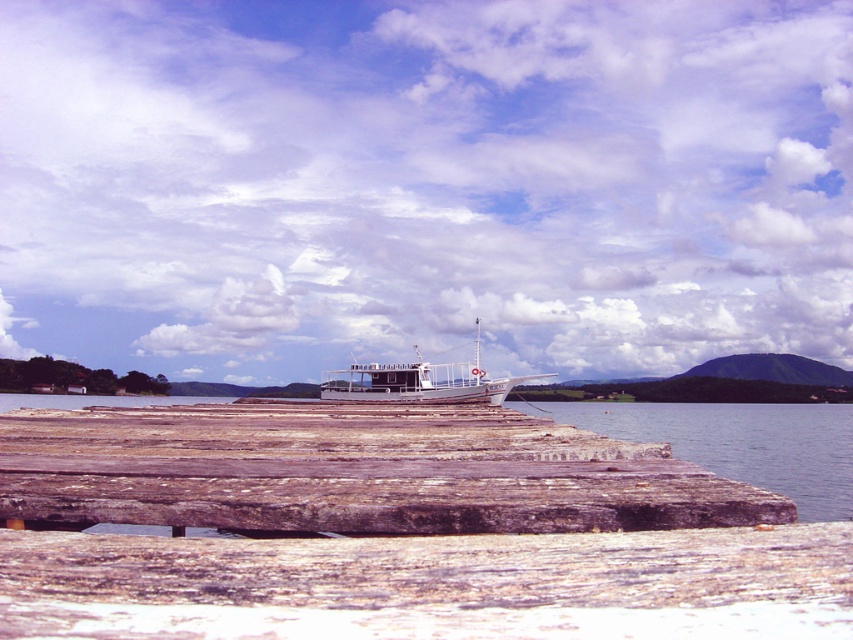
Looking at this image, you are planning to place a 2x2 meter square mat on the weathered wood dock at center. Given the size relationship between the dock and the clear water at dock right, can the mat fit entirely on the dock?

The weathered wood dock at center has a smaller size compared to the clear water at dock right, so the mat may not fit entirely on the dock since the dock is smaller than the water area.

You are standing on the shore and want to board the white wooden boat at center. The weathered wood dock at center is in your path. Considering their heights, which one is easier to step onto first?

The weathered wood dock at center has a lesser height compared to the white wooden boat at center, so it is easier to step onto the weathered wood dock at center first before boarding the white wooden boat at center.

You are standing on the weathered wood dock at center and want to step onto the clear water at dock right. Is the dock lower than the water level here?

The weathered wood dock at center has a lesser height compared to clear water at dock right, so yes, the dock is lower than the water level here.